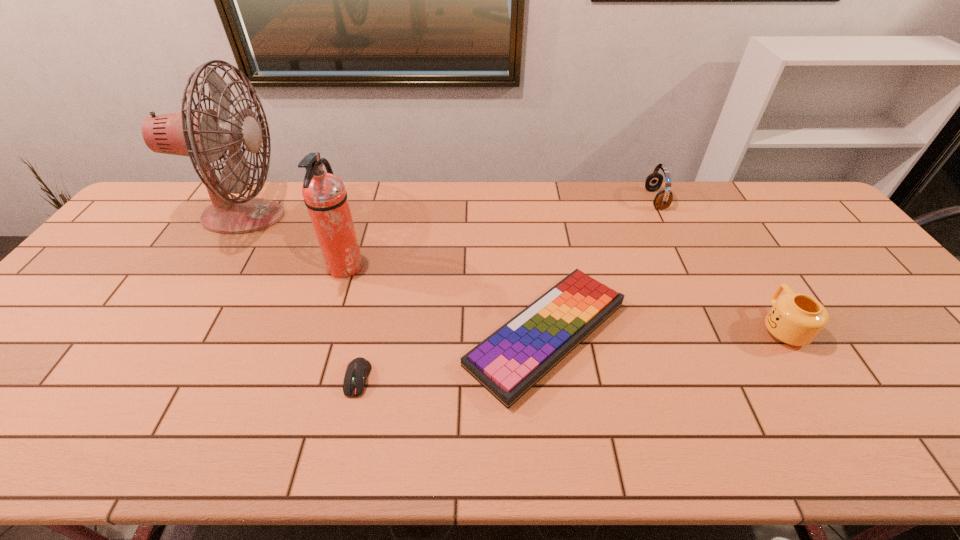
Find the location of `fan at the far edge`. fan at the far edge is located at coordinates (206, 135).

At what (x,y) coordinates should I click in order to perform the action: click on headset located at the far edge. Please return your answer as a coordinate pair (x, y). The width and height of the screenshot is (960, 540). Looking at the image, I should click on (663, 199).

The image size is (960, 540). In order to click on free spot at the far edge of the desktop in this screenshot , I will do `click(275, 189)`.

The width and height of the screenshot is (960, 540). Find the location of `free region at the near edge`. free region at the near edge is located at coordinates (898, 437).

Where is `vacant area between the third object from right to left and the second object from right to left`? The width and height of the screenshot is (960, 540). vacant area between the third object from right to left and the second object from right to left is located at coordinates (601, 267).

Identify the location of free spot between the fan and the headset. (449, 208).

At what (x,y) coordinates should I click in order to perform the action: click on blank region between the third object from right to left and the fifth shortest object. Please return your answer as a coordinate pair (x, y). The width and height of the screenshot is (960, 540). Looking at the image, I should click on (445, 301).

Image resolution: width=960 pixels, height=540 pixels. Find the location of `vacant area that lies between the second object from left to right and the tallest object`. vacant area that lies between the second object from left to right and the tallest object is located at coordinates (294, 242).

You are a GUI agent. You are given a task and a screenshot of the screen. Output one action in this format:
    pyautogui.click(x=<x>, y=<y>)
    Task: Click on the vacant area between the second shortest object and the mug
    The image size is (960, 540).
    Given the screenshot: What is the action you would take?
    coord(663,330)

Locate an element on the screen. The height and width of the screenshot is (540, 960). vacant area that lies between the fifth shortest object and the tallest object is located at coordinates (294, 242).